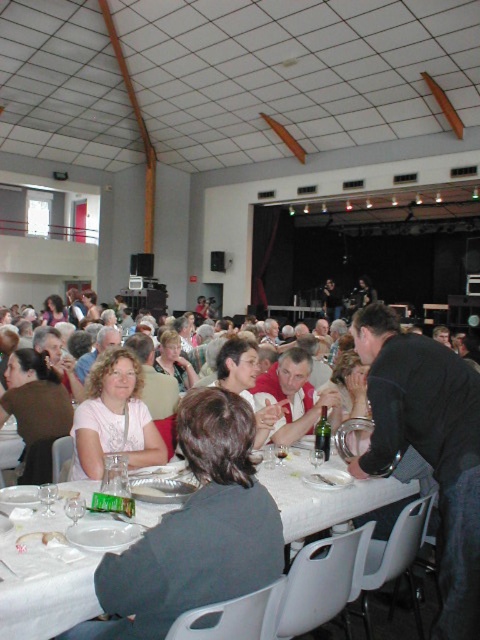
Who is more forward, [249,410] or [88,604]?

Point [88,604]

Find the location of a particular element. white fabric shirt at center is located at coordinates (194, 531).

Describe the element at coordinates (324, 497) in the screenshot. I see `white plastic table at lower center` at that location.

Identify the location of white plastic table at lower center. This screenshot has width=480, height=640. (324, 497).

Find the location of `white plastic table at lower center`. white plastic table at lower center is located at coordinates (324, 497).

The height and width of the screenshot is (640, 480). In order to click on white plastic table at lower center in this screenshot , I will do `click(324, 497)`.

Who is more forward, (146, 625) or (134, 388)?

Positioned in front is point (146, 625).

Between white fabric shirt at center and matte pink shirt at center, which one is positioned higher?

Positioned higher is matte pink shirt at center.

Where is `white fabric shirt at center`? The height and width of the screenshot is (640, 480). white fabric shirt at center is located at coordinates (194, 531).